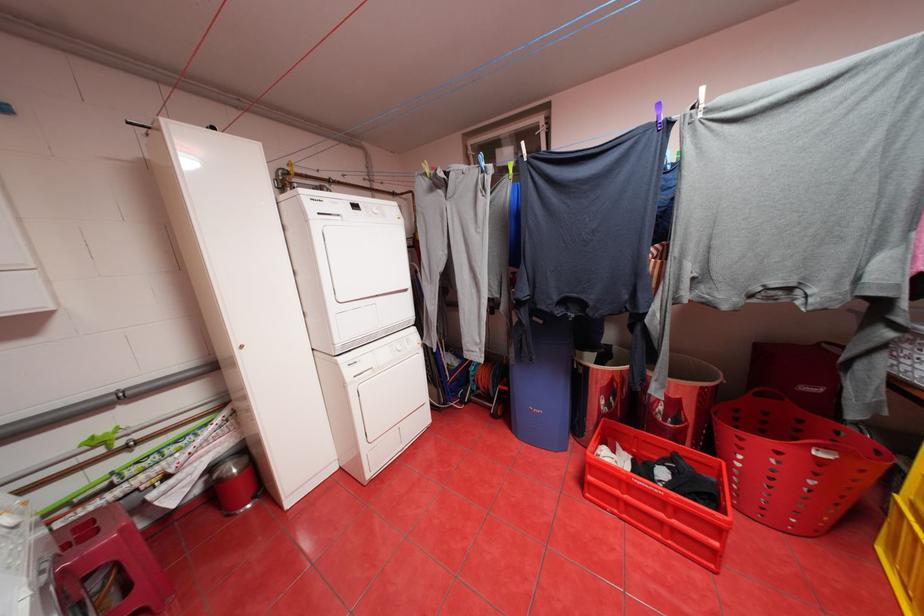
Where is `red plastic stool`? The height and width of the screenshot is (616, 924). red plastic stool is located at coordinates (106, 565).